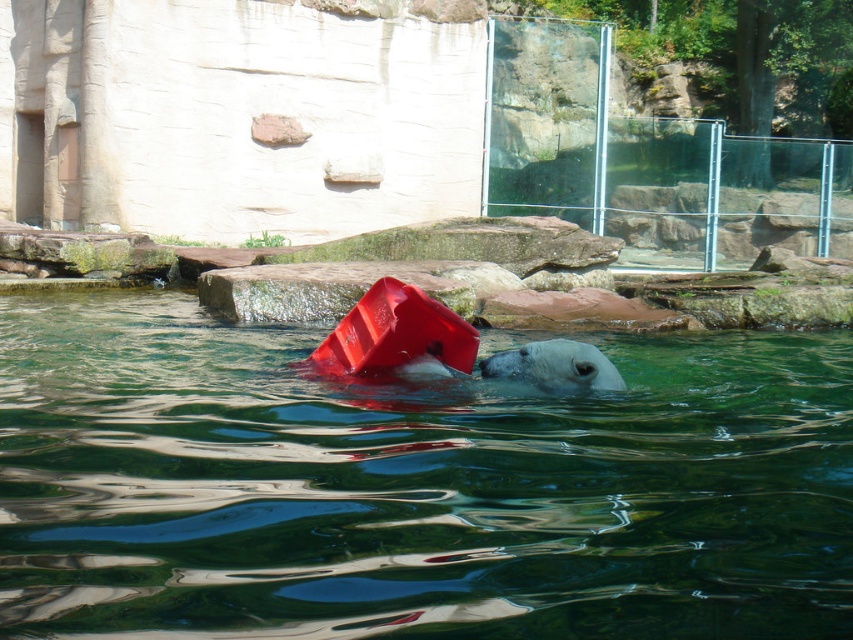
Question: Among these objects, which one is farthest from the camera?

Choices:
 (A) white matte bear at center
 (B) smooth plastic pool at center

Answer: (A)

Question: Among these objects, which one is nearest to the camera?

Choices:
 (A) smooth plastic pool at center
 (B) white matte bear at center

Answer: (A)

Question: Is smooth plastic pool at center below white matte bear at center?

Choices:
 (A) yes
 (B) no

Answer: (A)

Question: Which of the following is the closest to the observer?

Choices:
 (A) white matte bear at center
 (B) smooth plastic pool at center

Answer: (B)

Question: Is smooth plastic pool at center above white matte bear at center?

Choices:
 (A) yes
 (B) no

Answer: (B)

Question: Does smooth plastic pool at center come behind white matte bear at center?

Choices:
 (A) yes
 (B) no

Answer: (B)